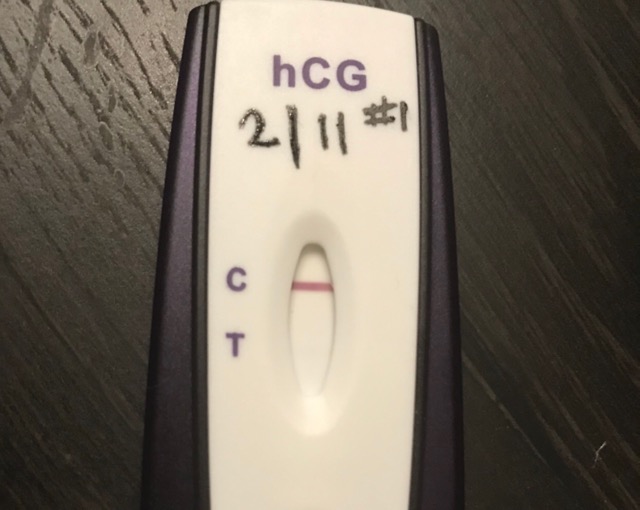
You are a GUI agent. You are given a task and a screenshot of the screen. Output one action in this format:
    pyautogui.click(x=<x>, y=<y>)
    Task: Click on the table surface
    This screenshot has width=640, height=510.
    Given the screenshot: What is the action you would take?
    pyautogui.click(x=495, y=212)